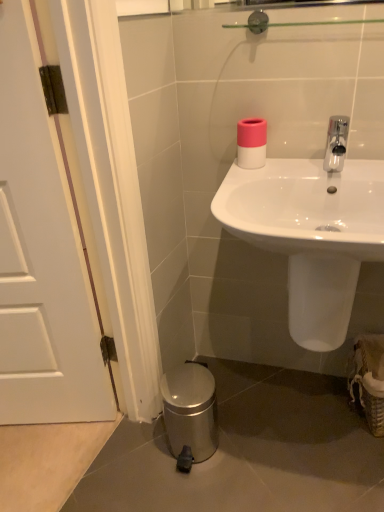
Where is `free space between woven straw basket at lower right and white matte door at left`? This screenshot has height=512, width=384. free space between woven straw basket at lower right and white matte door at left is located at coordinates (266, 445).